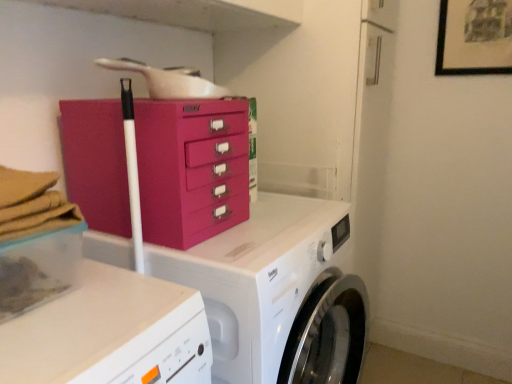
Identify the location of free space above white glossy washing machine at center (from a real-world perspective). This screenshot has height=384, width=512. (274, 230).